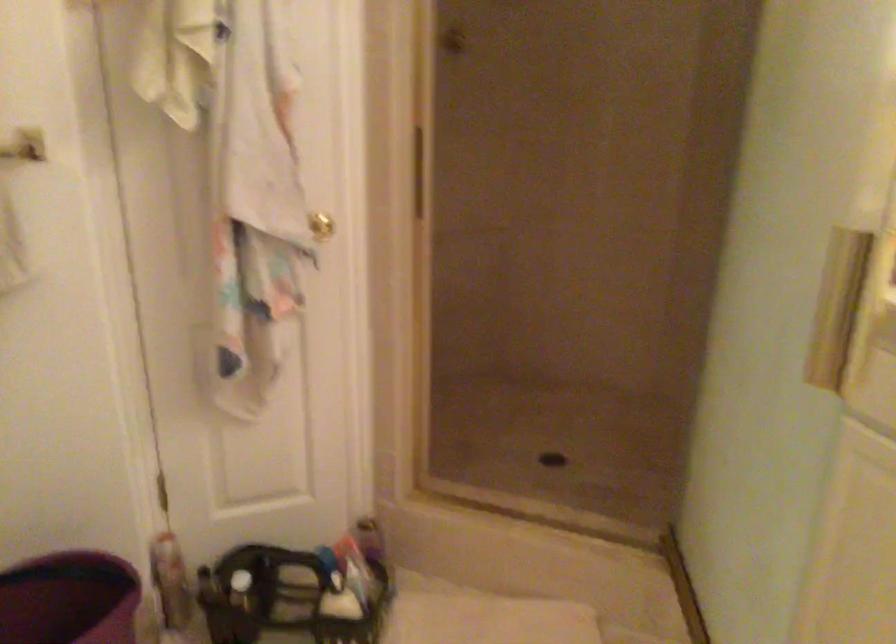
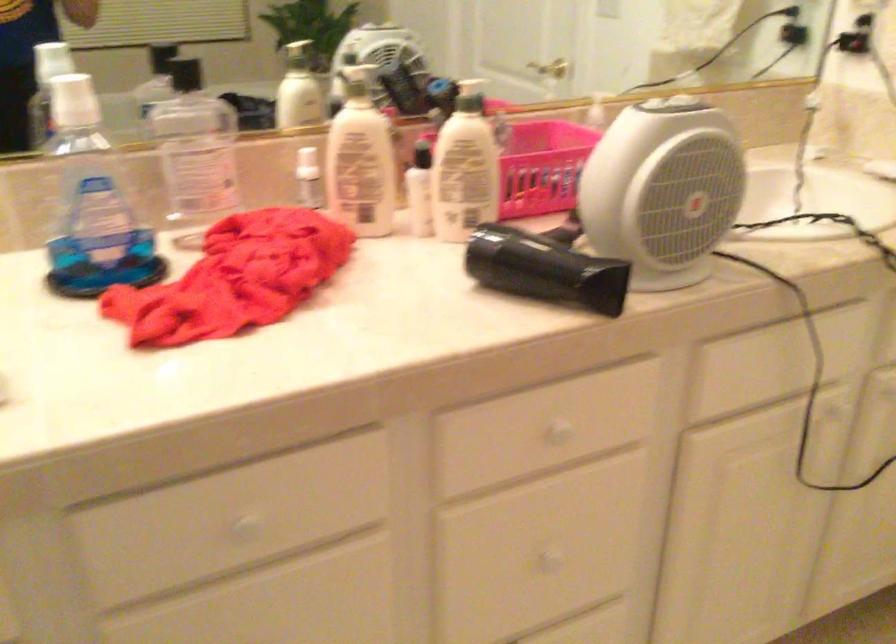
Based on the continuous images, in which direction is the camera rotating?

The camera's rotation is toward right-down.